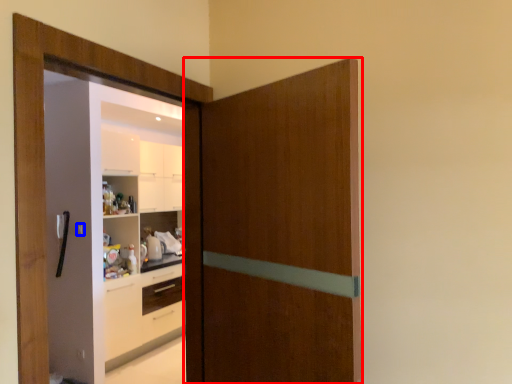
Question: Which point is closer to the camera, door (highlighted by a red box) or door handle (highlighted by a blue box)?

Choices:
 (A) door
 (B) door handle

Answer: (A)